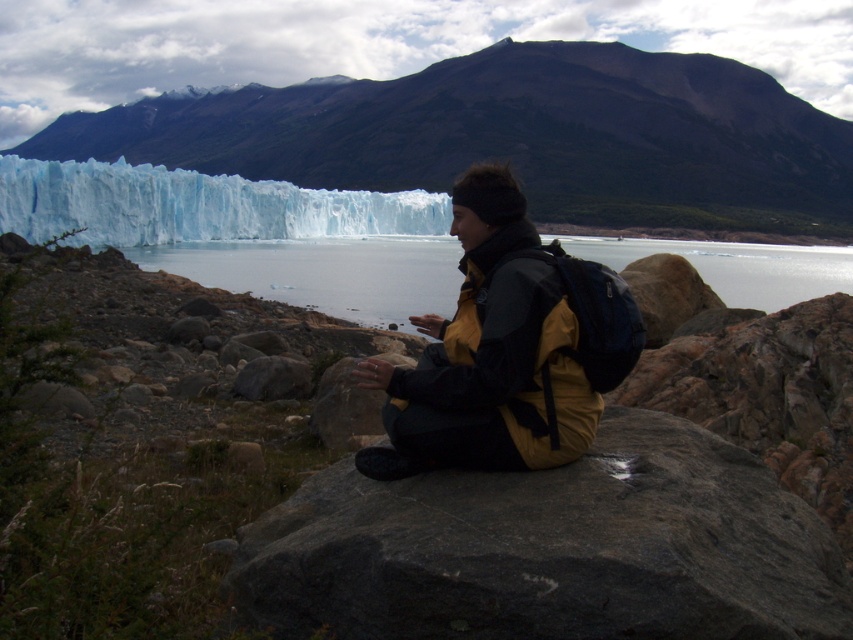
Question: Which object appears farthest from the camera in this image?

Choices:
 (A) transparent ice glacier at lower left
 (B) yellow fabric jacket at center
 (C) clear water at center
 (D) gray rough rock at center

Answer: (A)

Question: Can you confirm if yellow fabric jacket at center is positioned to the right of transparent ice glacier at lower left?

Choices:
 (A) no
 (B) yes

Answer: (B)

Question: Does gray rough rock at center have a lesser width compared to yellow fabric jacket at center?

Choices:
 (A) no
 (B) yes

Answer: (A)

Question: Is gray rough rock at center positioned at the back of yellow fabric jacket at center?

Choices:
 (A) no
 (B) yes

Answer: (A)

Question: Among these points, which one is nearest to the camera?

Choices:
 (A) (712, 497)
 (B) (49, 202)
 (C) (283, 256)
 (D) (477, 273)

Answer: (A)

Question: Which point appears closest to the camera in this image?

Choices:
 (A) (212, 285)
 (B) (473, 627)
 (C) (218, 186)
 (D) (457, 337)

Answer: (B)